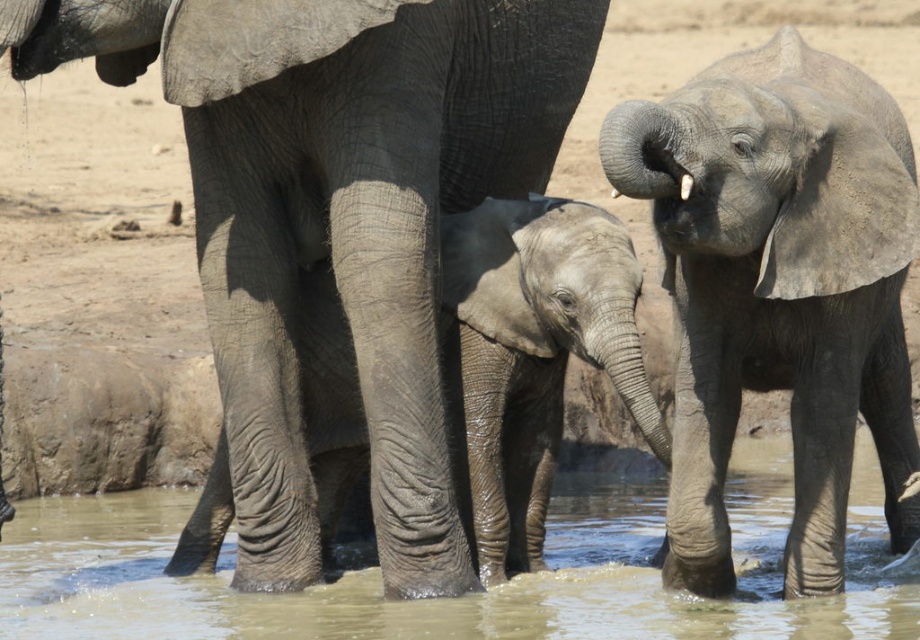
Is gray matte elephant at center bigger than gray textured baby elephant at center?

Yes, gray matte elephant at center is bigger than gray textured baby elephant at center.

Is gray matte elephant at center taller than gray textured baby elephant at center?

Yes, gray matte elephant at center is taller than gray textured baby elephant at center.

Which is behind, point (843, 362) or point (481, 433)?

Point (481, 433)

This screenshot has width=920, height=640. In order to click on gray matte elephant at center in this screenshot , I will do `click(778, 289)`.

Which of these two, gray wrinkled elephant at center or gray matte elephant at center, stands shorter?

With less height is gray matte elephant at center.

Who is more forward, [294,122] or [832,196]?

Point [832,196] is in front.

Where is `gray wrinkled elephant at center`? This screenshot has height=640, width=920. gray wrinkled elephant at center is located at coordinates (336, 216).

From the picture: Can you confirm if gray matte elephant at center is bigger than brown muddy water at center?

Correct, gray matte elephant at center is larger in size than brown muddy water at center.

Is point (801, 504) more distant than point (4, 611)?

That is False.

Is point (906, 273) positioned after point (169, 492)?

That is False.

Find the location of a particular element. The width and height of the screenshot is (920, 640). gray matte elephant at center is located at coordinates (778, 289).